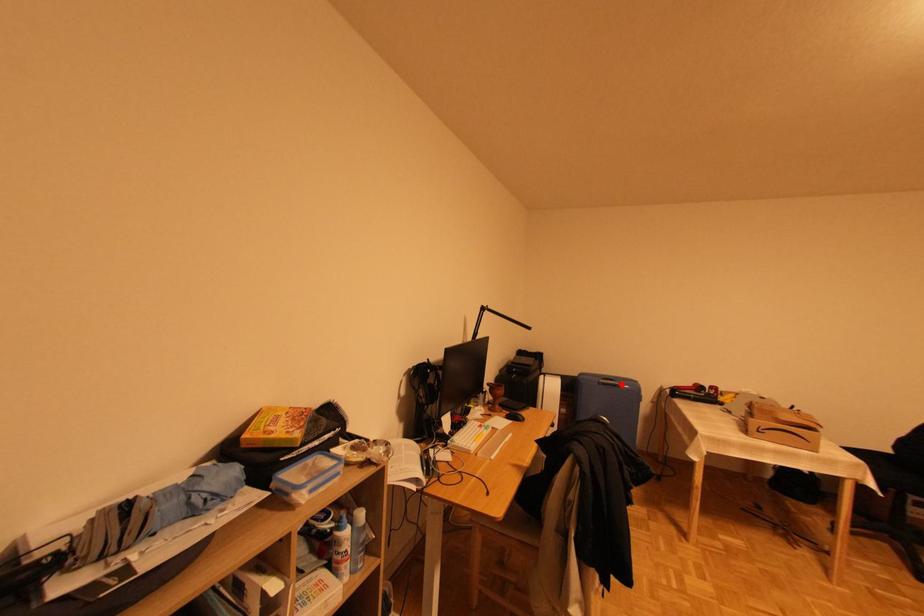
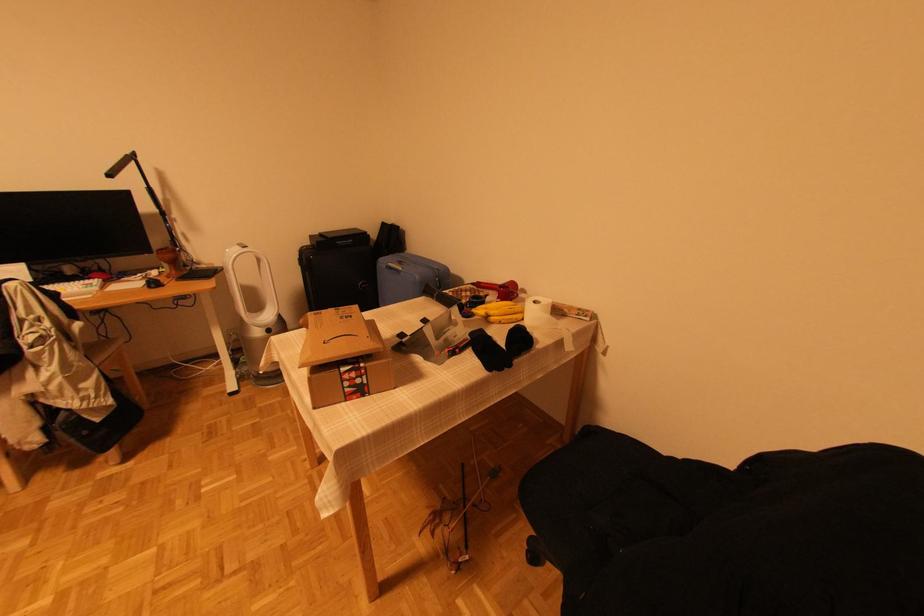
Locate, in the second image, the point that corresponds to the highlighted location in the first image.

(403, 270)